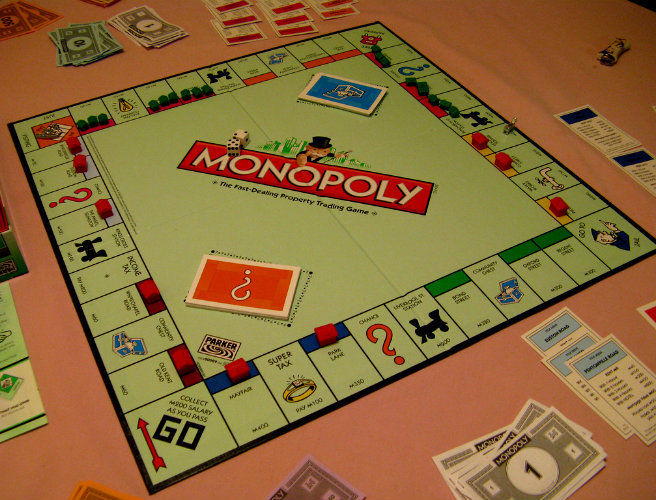
I want to click on hotels, so click(x=150, y=288), click(x=189, y=359), click(x=233, y=365), click(x=323, y=334), click(x=561, y=203), click(x=504, y=161), click(x=480, y=137), click(x=73, y=145), click(x=83, y=167), click(x=103, y=206).